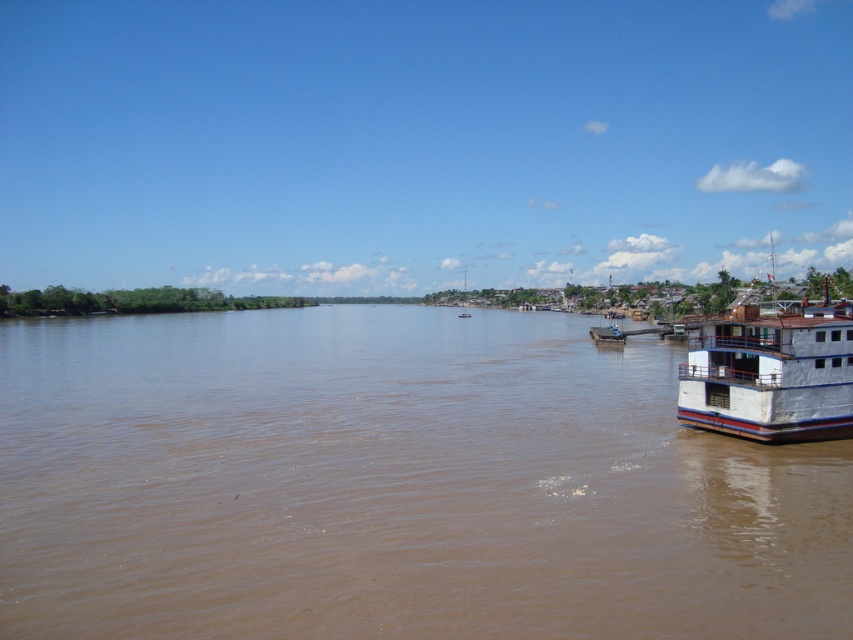
You are a photographer planning to capture the entire scene of the brown muddy water at center and the white plastic boat at center in a single shot. Given that your camera can only focus on objects larger than the other, which object will your camera prioritize?

The brown muddy water at center is bigger than the white plastic boat at center, so the camera will prioritize focusing on the brown muddy water at center.